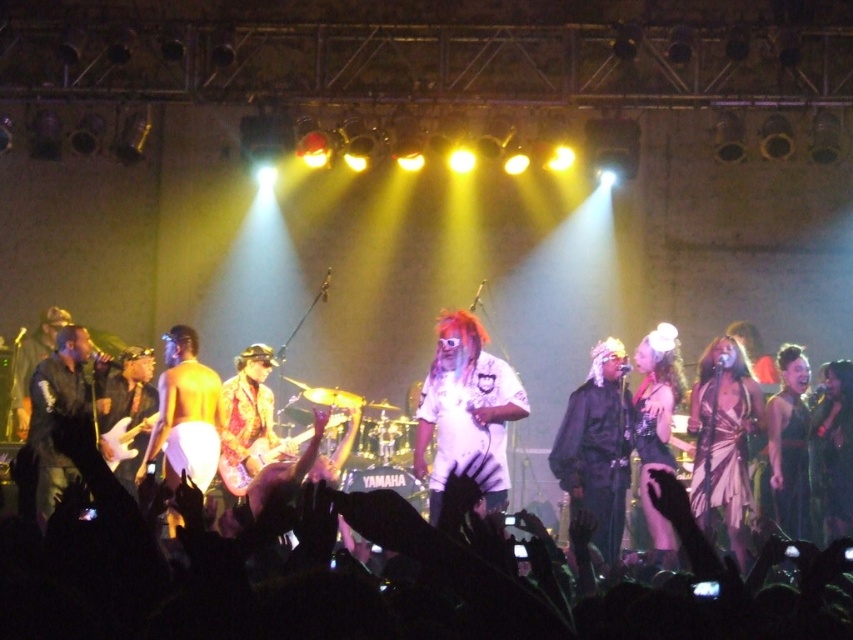
Is silky purple dress at center right behind black satin dress at right?

No, silky purple dress at center right is in front of black satin dress at right.

Does point (723, 490) come closer to viewer compared to point (779, 472)?

Yes.

Is point (718, 404) closer to camera compared to point (775, 513)?

Yes.

This screenshot has width=853, height=640. Identify the location of silky purple dress at center right. (723, 440).

Does silky purple dress at center right have a greater width compared to black leather jacket at left?

Indeed, silky purple dress at center right has a greater width compared to black leather jacket at left.

Can you confirm if silky purple dress at center right is taller than black leather jacket at left?

Yes.

Is point (703, 381) closer to camera compared to point (50, 381)?

Yes, point (703, 381) is closer to viewer.

At what (x,y) coordinates should I click in order to perform the action: click on silky purple dress at center right. Please return your answer as a coordinate pair (x, y). The image size is (853, 640). Looking at the image, I should click on (723, 440).

Can you confirm if shiny black jacket at center is positioned to the right of shiny silver dress at center right?

Incorrect, shiny black jacket at center is not on the right side of shiny silver dress at center right.

The height and width of the screenshot is (640, 853). In order to click on shiny black jacket at center in this screenshot , I will do tap(596, 448).